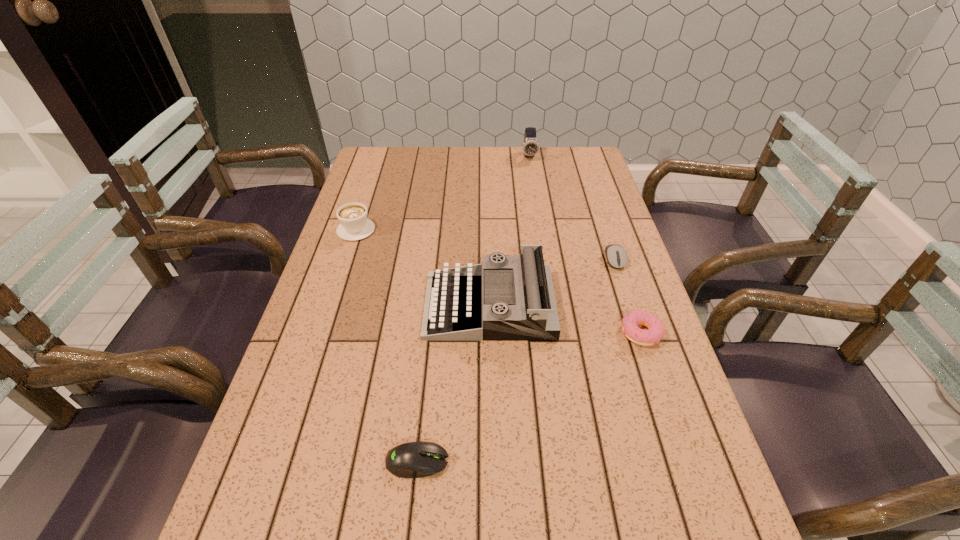
Find the location of a particular element. free point between the third farthest object and the farthest object is located at coordinates (572, 208).

Where is `free spot between the doughnut and the farthest object`? The height and width of the screenshot is (540, 960). free spot between the doughnut and the farthest object is located at coordinates (586, 245).

Locate an element on the screen. This screenshot has width=960, height=540. blank region between the typewriter and the cappuccino is located at coordinates (422, 268).

Where is `free space between the second farthest object and the farther computer mouse`? free space between the second farthest object and the farther computer mouse is located at coordinates (486, 245).

This screenshot has height=540, width=960. Identify the location of empty location between the doughnut and the typewriter. (565, 319).

This screenshot has height=540, width=960. Identify the location of object identified as the fifth closest to the typewriter. (530, 147).

Locate which object is the fourth closest to the farthest object. Please provide its 2D coordinates. Your answer should be formatted as a tuple, i.e. [(x, y)], where the tuple contains the x and y coordinates of a point satisfying the conditions above.

[(630, 322)]

Find the location of a particular element. Image resolution: width=960 pixels, height=540 pixels. free spot that satisfies the following two spatial constraints: 1. on the wheel side of the third farthest object; 2. on the wheel side of the nearer computer mouse is located at coordinates (681, 461).

This screenshot has height=540, width=960. In order to click on vacant area that satisfies the following two spatial constraints: 1. on the face of the farthest object; 2. on the left side of the doughnut in this screenshot , I will do [x=558, y=333].

Identify the location of vacant space that satisfies the following two spatial constraints: 1. on the typing side of the doughnut; 2. on the right side of the typewriter. (490, 333).